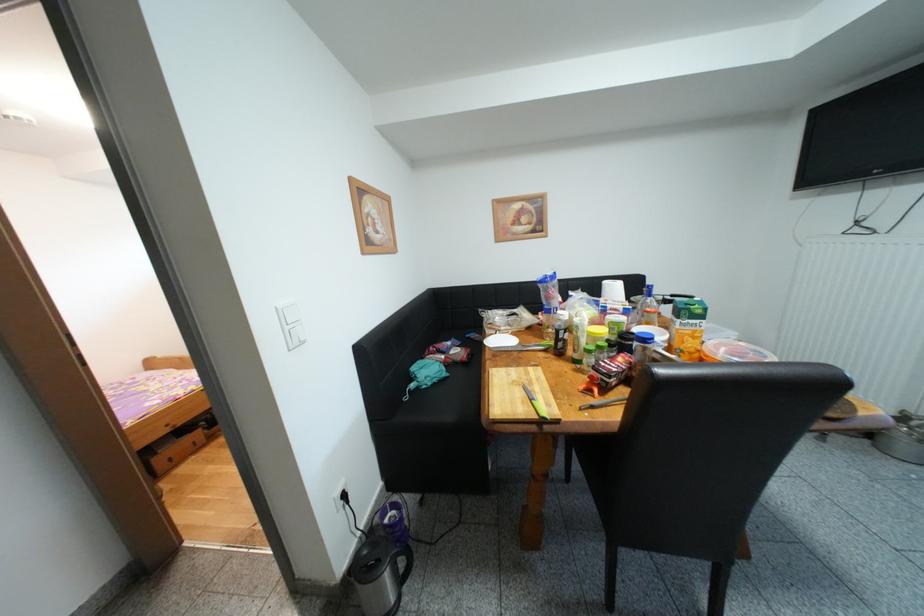
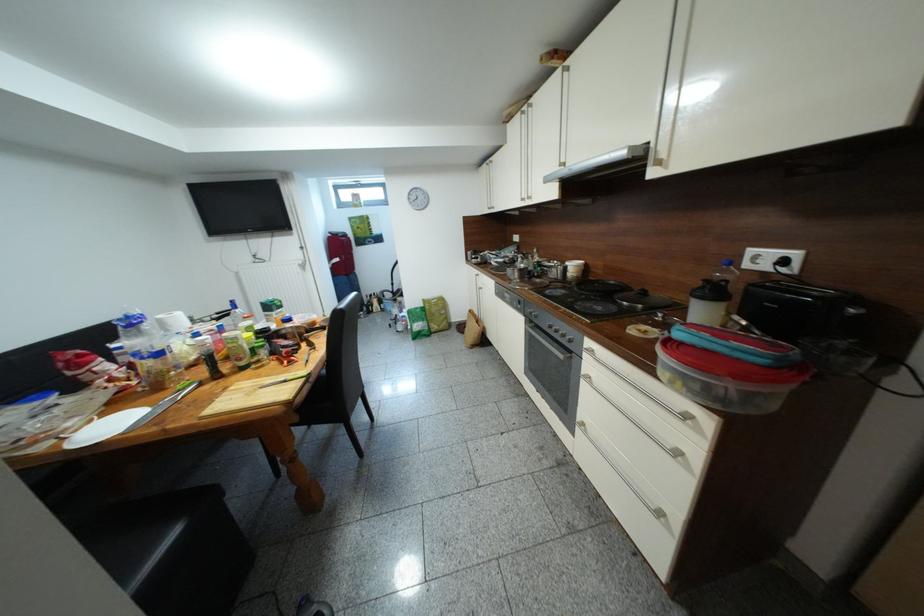
Looking at this image, how did the camera likely rotate?

The camera rotated toward right-down.